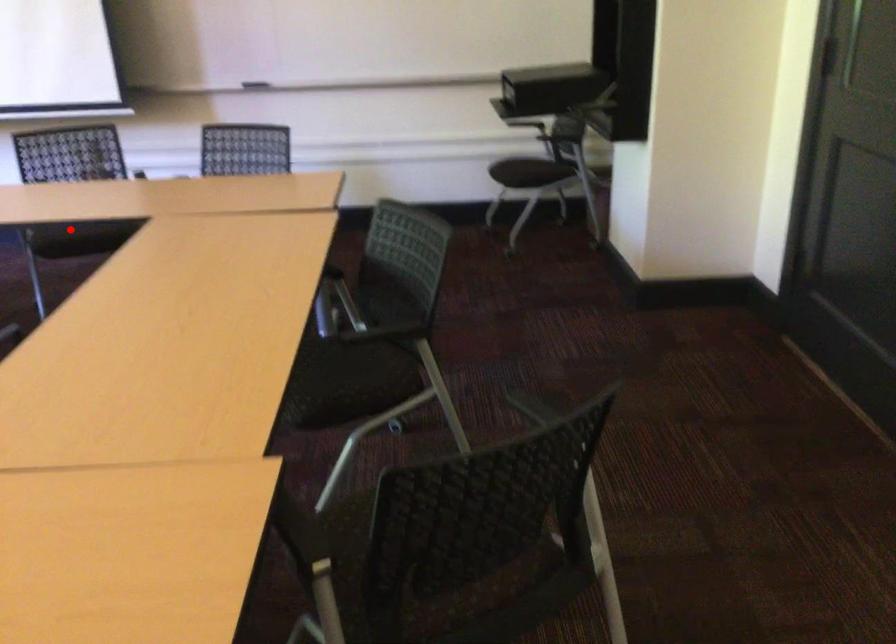
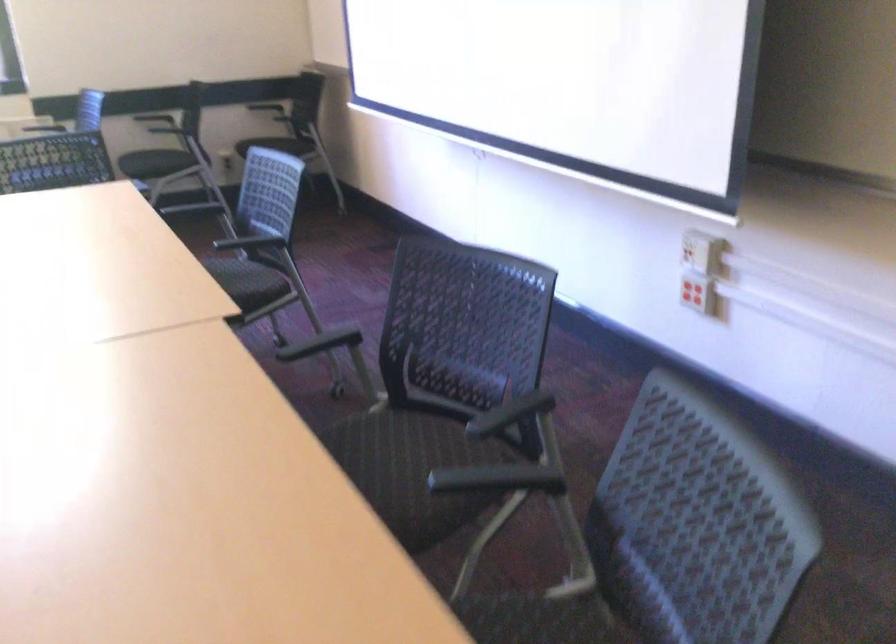
Question: I am providing you with two images of the same scene from different viewpoints. Image1 has a red point marked. In image2, the corresponding 3D location appears at what relative position? Reply with the corresponding letter.

Choices:
 (A) Closer
 (B) Farther

Answer: (A)